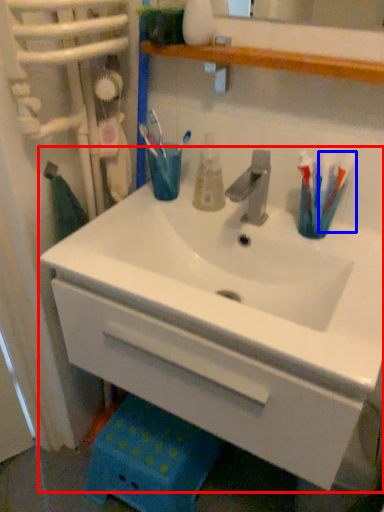
Question: Among these objects, which one is farthest to the camera, sink (highlighted by a red box) or toothbrush (highlighted by a blue box)?

Choices:
 (A) sink
 (B) toothbrush

Answer: (B)